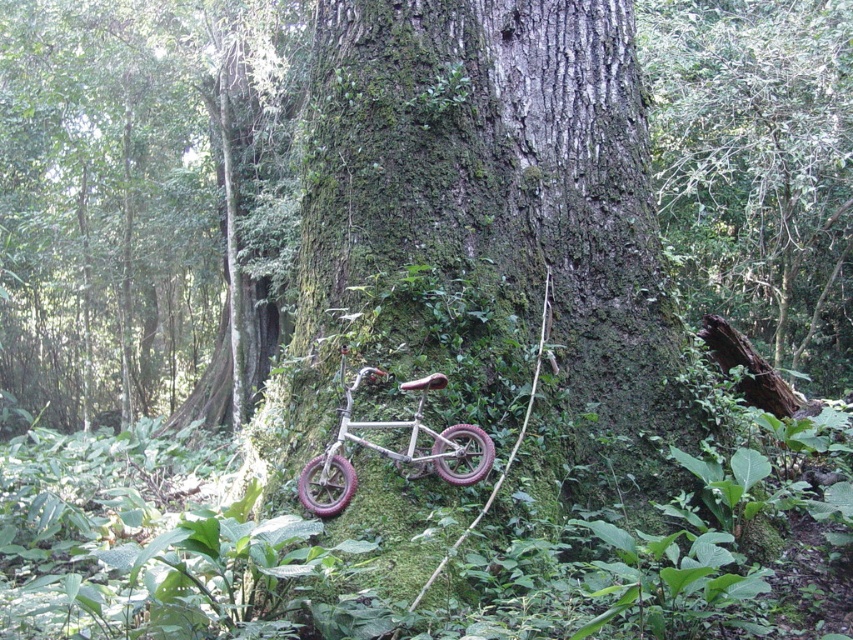
You are a photographer standing in front of the large tree trunk. You notice two points marked in the scene. The first point is at coordinate point(x=44, y=403) and the second is at point(x=469, y=426). If you want to focus your camera on the nearest point to you, which coordinate should you adjust your lens to?

You should focus on point(x=44, y=403) because it is closer to you than point(x=469, y=426).

You are a hiker who has just found an old bicycle in the forest. You want to move the metallic matte bicycle at center to a clearing nearby. However, you notice the smooth bark tree at center is in the way. Based on the scene, can you determine if the tree is blocking your path to move the bicycle?

The smooth bark tree at center is positioned over the metallic matte bicycle at center, meaning the tree is directly above the bicycle. To move the bicycle, you would need to navigate around the tree since moving it from underneath might be obstructed by the tree trunk.

You are standing in the forest looking at the tree. Which part of the tree would you touch first if you reached out to the green mossy bark at center and smooth bark tree at center?

The green mossy bark at center is closer to the viewer than the smooth bark tree at center, so you would touch the green mossy bark at center first.